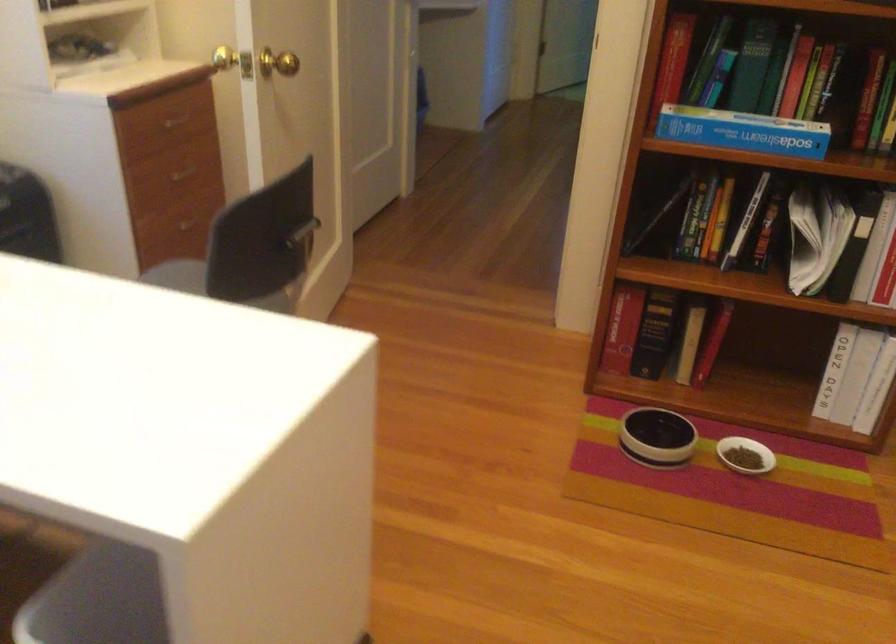
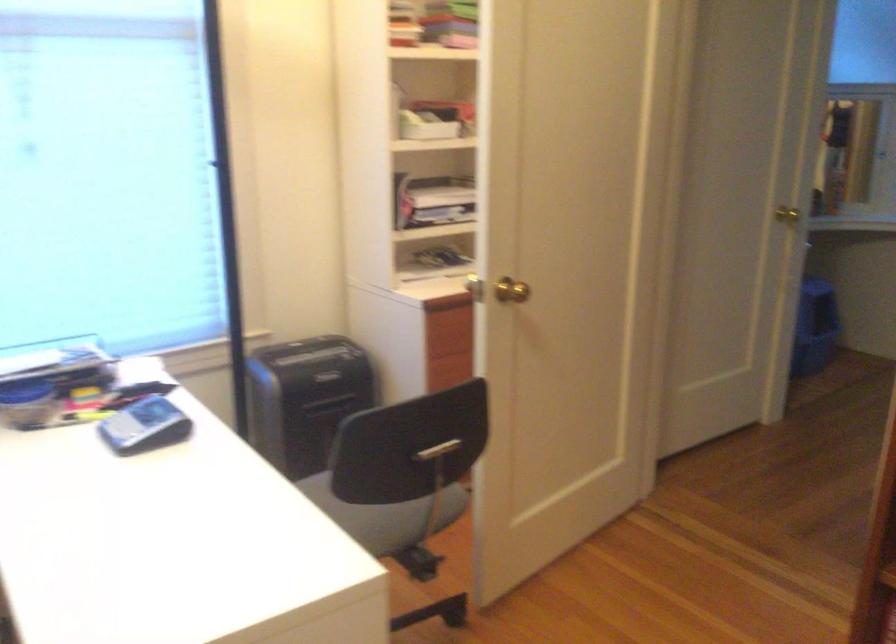
Question: I am providing you with two images of the same scene from different viewpoints. Which of the following objects are not visible in image2?

Choices:
 (A) drawer knob
 (B) red towel
 (C) gold door knob
 (D) grey calculator

Answer: (A)